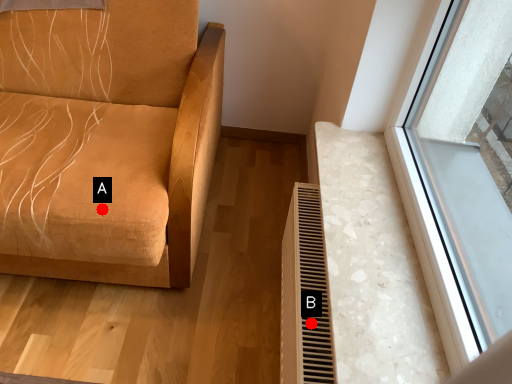
Question: Two points are circled on the image, labeled by A and B beside each circle. Which point is closer to the camera taking this photo?

Choices:
 (A) A is closer
 (B) B is closer

Answer: (B)